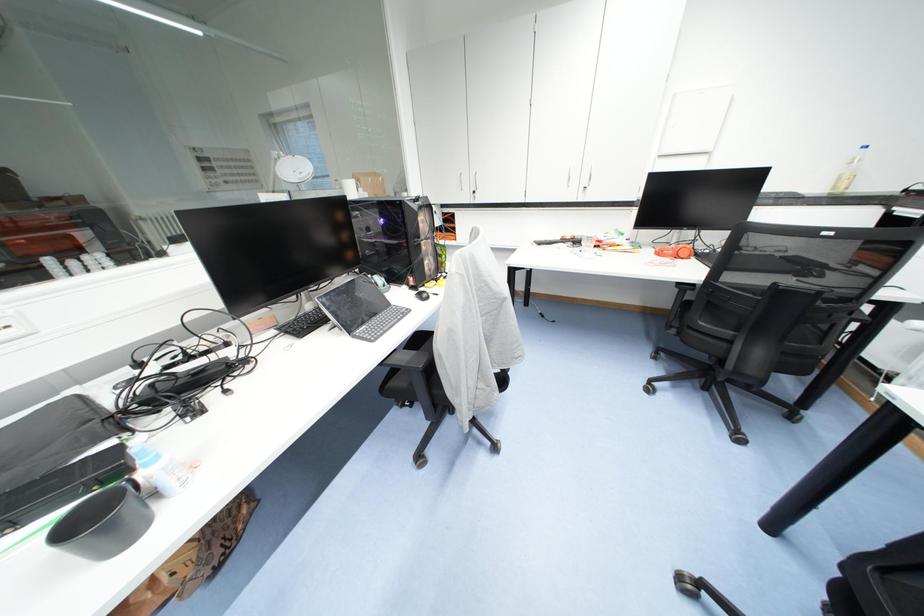
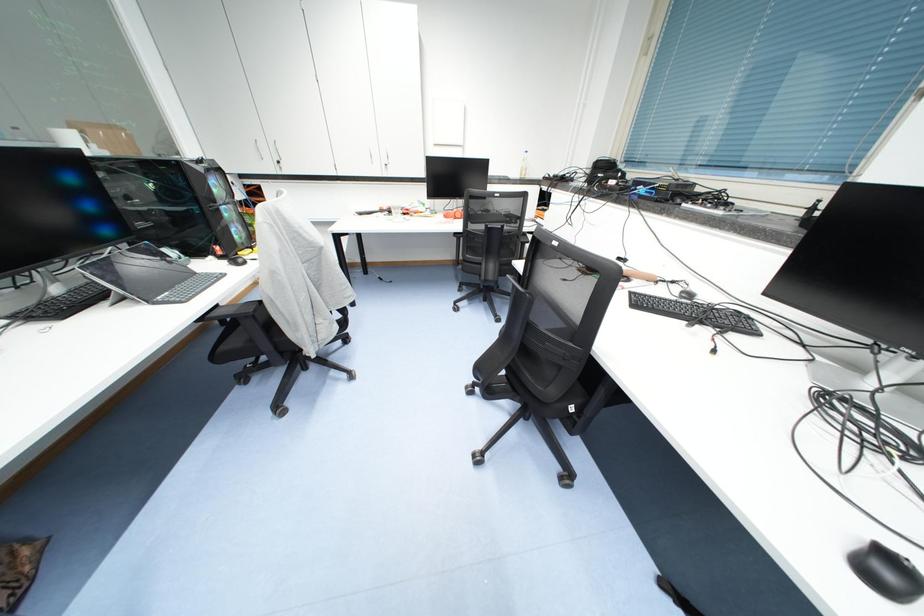
Question: The camera is either moving clockwise (left) or counter-clockwise (right) around the object. The first image is from the beginning of the video and the second image is from the end. Is the camera moving left or right when shooting the video?

Choices:
 (A) Left
 (B) Right

Answer: (A)